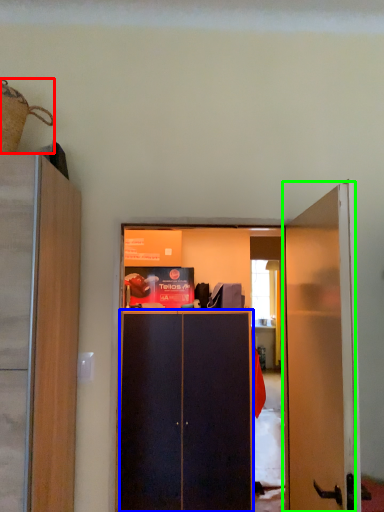
Question: Which is farther away from houseplant (highlighted by a red box)? screen door (highlighted by a blue box) or door (highlighted by a green box)?

Choices:
 (A) screen door
 (B) door

Answer: (A)